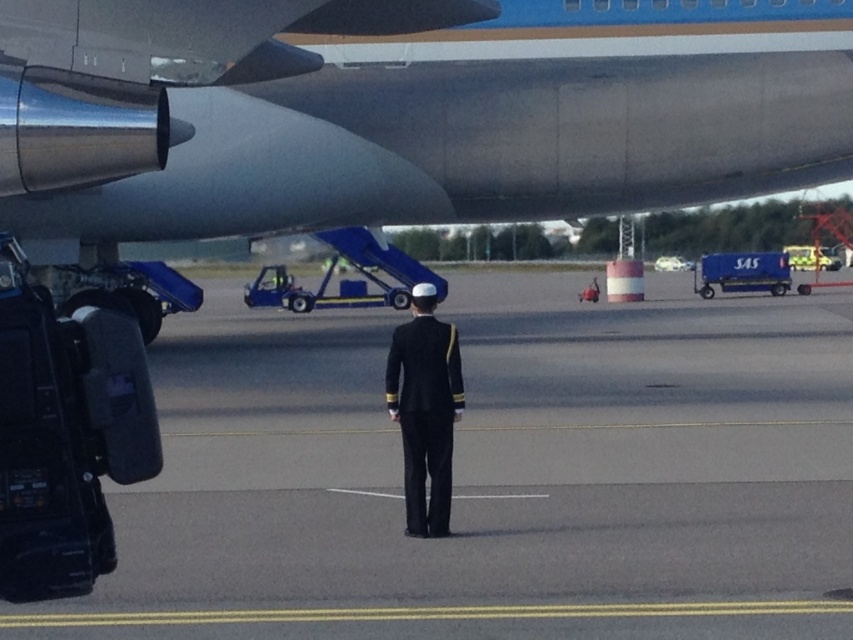
Question: Which point is farther to the camera?

Choices:
 (A) metallic gray airplane at upper center
 (B) black smooth tarmac at center

Answer: (A)

Question: Estimate the real-world distances between objects in this image. Which object is closer to the black smooth tarmac at center?

Choices:
 (A) metallic gray airplane at upper center
 (B) navy blue uniform at center

Answer: (A)

Question: Observing the image, what is the correct spatial positioning of black smooth tarmac at center in reference to navy blue uniform at center?

Choices:
 (A) left
 (B) right

Answer: (B)

Question: Does metallic gray airplane at upper center appear on the right side of navy blue uniform at center?

Choices:
 (A) yes
 (B) no

Answer: (B)

Question: Which object is positioned closest to the metallic gray airplane at upper center?

Choices:
 (A) black smooth tarmac at center
 (B) navy blue uniform at center

Answer: (A)

Question: Can you confirm if black smooth tarmac at center is positioned to the left of navy blue uniform at center?

Choices:
 (A) no
 (B) yes

Answer: (A)